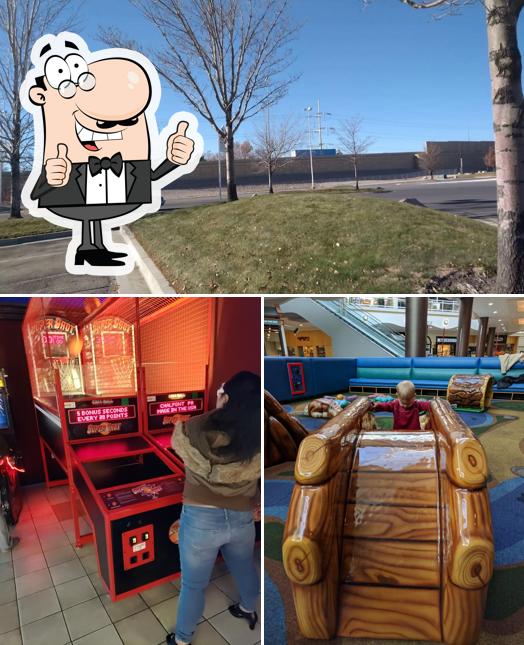
I want to click on place to sit down, so click(x=380, y=381).